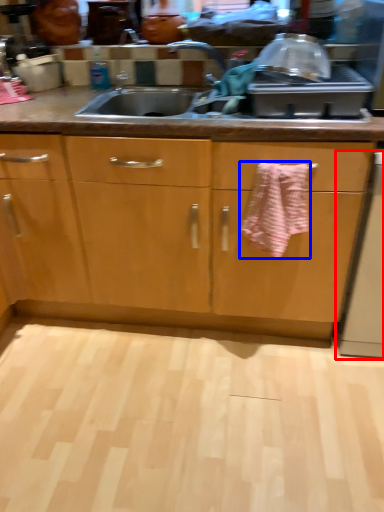
Question: Which object is closer to the camera taking this photo, dish washer (highlighted by a red box) or bath towel (highlighted by a blue box)?

Choices:
 (A) dish washer
 (B) bath towel

Answer: (A)